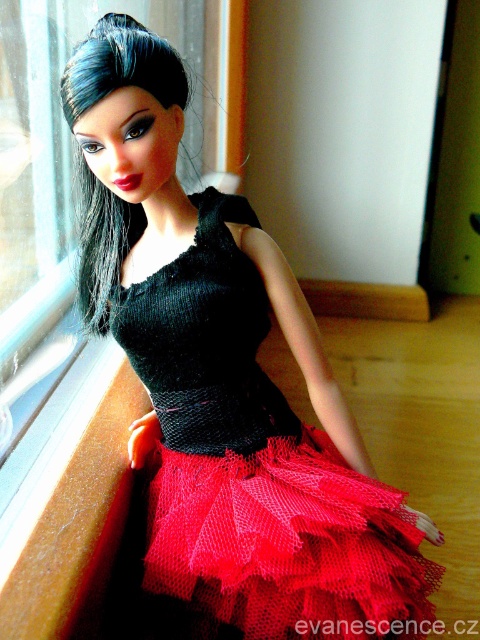
You are standing in the room where the doll is displayed. You want to place a small decorative item exactly at the point marked as point (288, 544). What object is currently located at that point?

The red tulle tutu at lower center is located at point (288, 544).

You are a photographer setting up a shoot with the doll. You need to ensure that the red tulle tutu at lower center and the transparent glass window at upper left are both visible in the frame. Given their sizes, which object will appear smaller in the final photo?

The red tulle tutu at lower center is shorter than the transparent glass window at upper left, so it will appear smaller in the final photo.

You are a photographer setting up a shoot for the doll. You want to ensure the red tulle tutu at lower center is well lit. Given the transparent glass window at upper left is the only light source, where should you position the doll to best illuminate the tutu?

The red tulle tutu at lower center is positioned under the transparent glass window at upper left, so positioning the doll directly beneath the window will ensure the natural light from the transparent glass window at upper left falls directly on the red tulle tutu at lower center, illuminating it effectively.